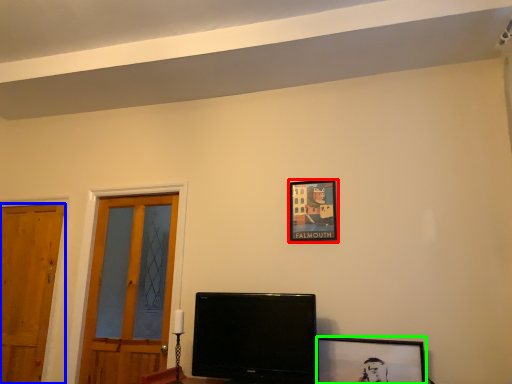
Question: Estimate the real-world distances between objects in this image. Which object is farther from picture frame (highlighted by a red box), door (highlighted by a blue box) or picture frame (highlighted by a green box)?

Choices:
 (A) door
 (B) picture frame

Answer: (A)